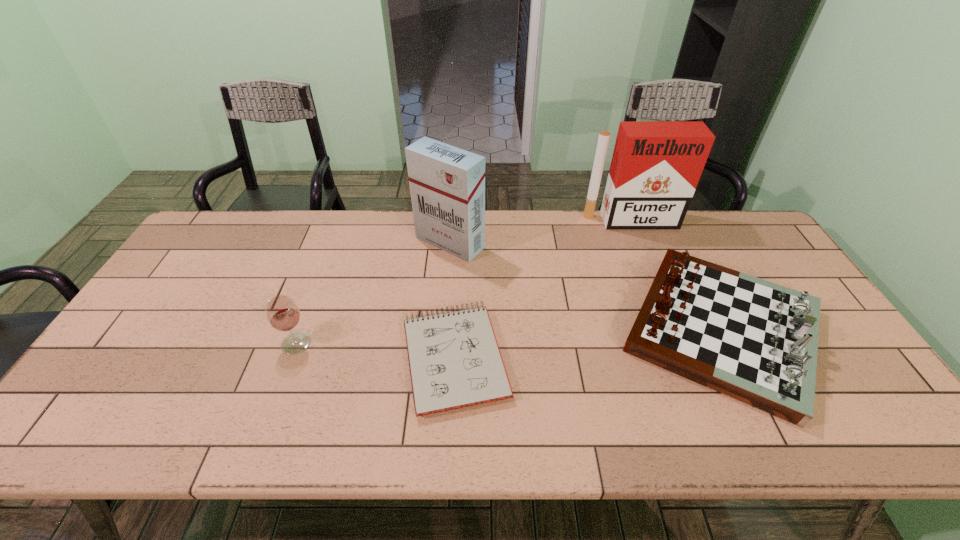
The width and height of the screenshot is (960, 540). Find the location of `free space between the left cigarette case and the right cigarette case`. free space between the left cigarette case and the right cigarette case is located at coordinates (540, 232).

This screenshot has height=540, width=960. Find the location of `free space between the notepad and the wineglass`. free space between the notepad and the wineglass is located at coordinates (375, 350).

The height and width of the screenshot is (540, 960). I want to click on empty space between the gameboard and the third tallest object, so click(x=509, y=336).

Locate an element on the screen. vacant region between the notepad and the left cigarette case is located at coordinates (452, 300).

You are a GUI agent. You are given a task and a screenshot of the screen. Output one action in this format:
    pyautogui.click(x=<x>, y=<y>)
    Task: Click on the free space between the wineglass and the left cigarette case
    
    Given the screenshot: What is the action you would take?
    pyautogui.click(x=373, y=293)

The image size is (960, 540). I want to click on free point between the notepad and the leftmost object, so click(x=375, y=350).

Find the location of a particular element. This screenshot has height=540, width=960. vacant space that's between the right cigarette case and the notepad is located at coordinates (542, 289).

I want to click on free space that is in between the right cigarette case and the third tallest object, so click(x=463, y=282).

You are a GUI agent. You are given a task and a screenshot of the screen. Output one action in this format:
    pyautogui.click(x=<x>, y=<y>)
    Task: Click on the free space between the right cigarette case and the wineglass
    
    Given the screenshot: What is the action you would take?
    pyautogui.click(x=463, y=282)

At what (x,y) coordinates should I click in order to perform the action: click on unoccupied area between the right cigarette case and the left cigarette case. Please return your answer as a coordinate pair (x, y). This screenshot has height=540, width=960. Looking at the image, I should click on (540, 232).